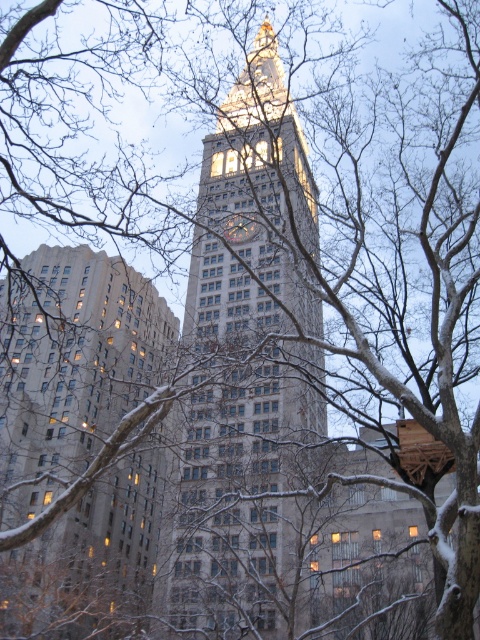
Can you confirm if stone clock tower at center is bigger than gray stone building at center?

Yes, stone clock tower at center is bigger than gray stone building at center.

This screenshot has width=480, height=640. What do you see at coordinates (247, 369) in the screenshot? I see `stone clock tower at center` at bounding box center [247, 369].

I want to click on stone clock tower at center, so click(x=247, y=369).

The width and height of the screenshot is (480, 640). I want to click on stone clock tower at center, so click(247, 369).